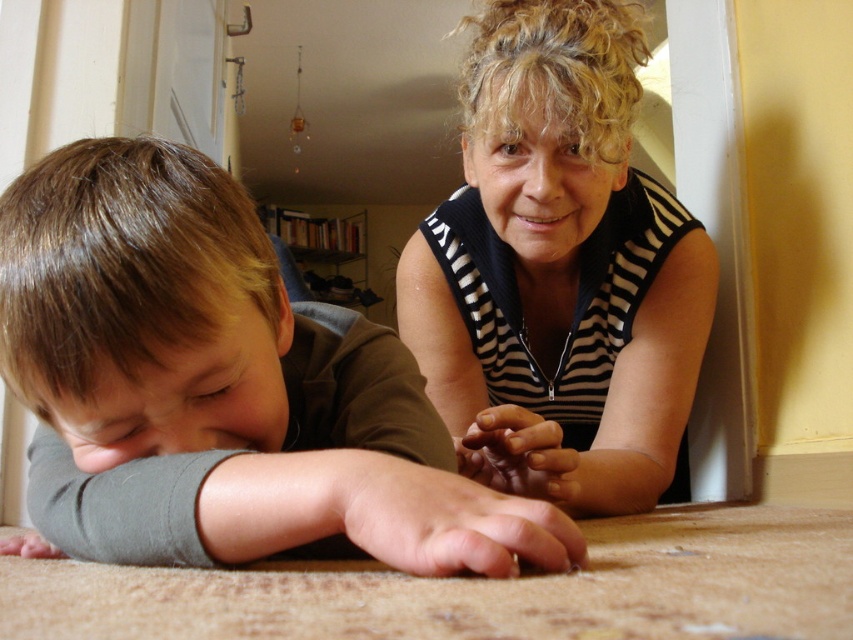
You are standing in the room and see two points marked in the image. The first point is at coordinates point (229,177) and the second point is at point (521,134). Which point is closer to you?

→ Point (229,177) is in front of point (521,134), so it is closer to you.

You are trying to decide which shirt to take for a photoshoot. Both the brown matte shirt at lower left and the black striped shirt at upper center are available. Based on their sizes, which one is narrower?

The brown matte shirt at lower left has a lesser width compared to the black striped shirt at upper center, so it is narrower.

You are a photographer trying to capture the scene. The point at coordinates (230, 372) is important for your composition. Which object does this point correspond to?

The point at coordinates (230, 372) corresponds to the brown matte shirt at lower left.